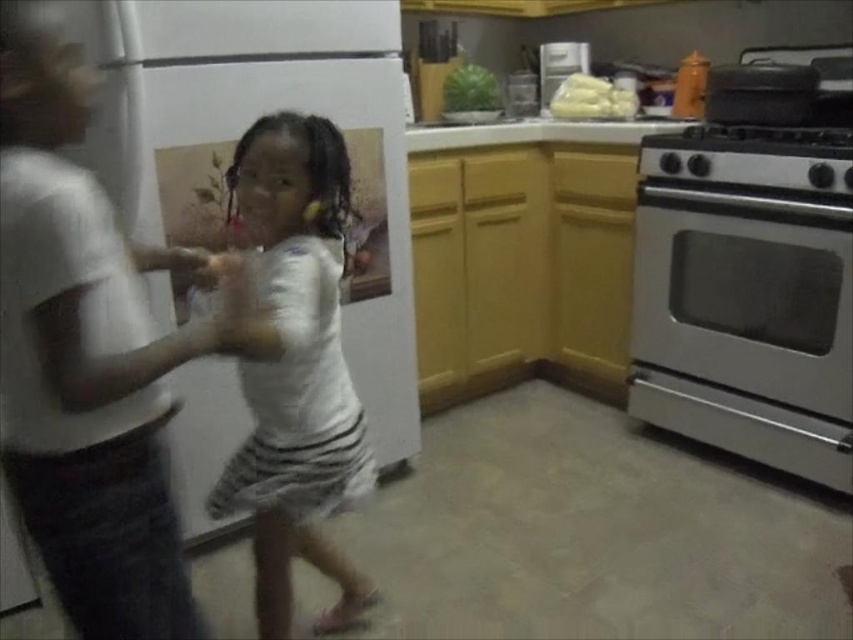
Question: Is stainless steel oven at right closer to camera compared to white fluffy food at upper center?

Choices:
 (A) no
 (B) yes

Answer: (B)

Question: Which point appears farthest from the camera in this image?

Choices:
 (A) (697, 150)
 (B) (831, 256)
 (C) (558, 102)

Answer: (C)

Question: Does white cotton shirt at center lie in front of stainless steel stove at right?

Choices:
 (A) no
 (B) yes

Answer: (B)

Question: Which point is farther to the camera?

Choices:
 (A) (561, 49)
 (B) (123, 355)
 (C) (323, 324)
 (D) (821, 214)

Answer: (A)

Question: Which point is closer to the camera taking this photo?

Choices:
 (A) (734, 152)
 (B) (538, 45)
 (C) (296, 186)
 (D) (556, 106)

Answer: (C)

Question: Is white fluffy food at upper center below clear glass jar at upper center?

Choices:
 (A) no
 (B) yes

Answer: (B)